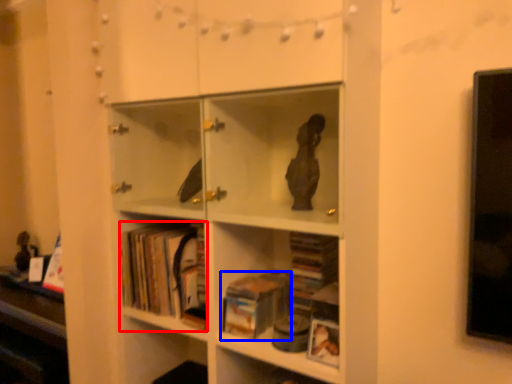
Question: Which of the following is the farthest to the observer, book (highlighted by a red box) or book (highlighted by a blue box)?

Choices:
 (A) book
 (B) book

Answer: (A)